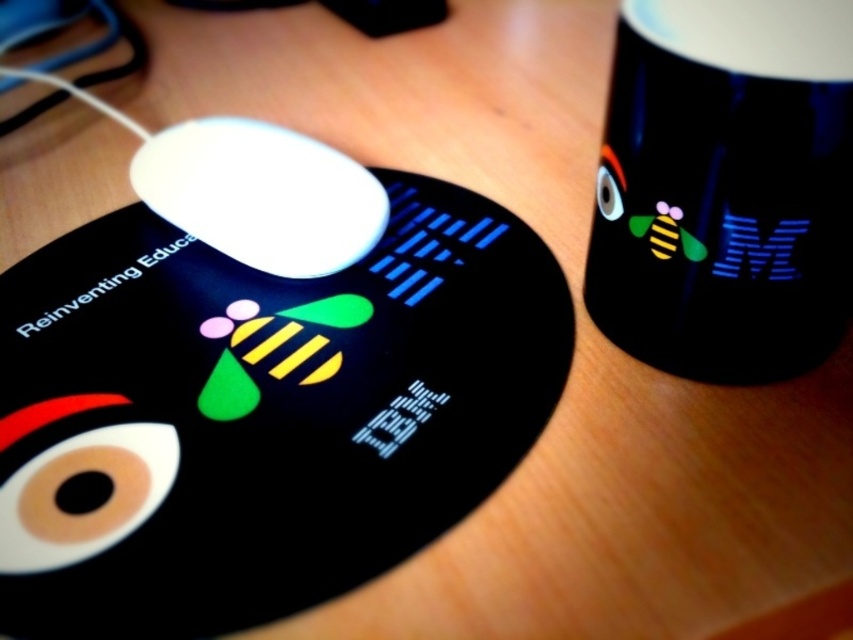
Between point (728, 12) and point (366, 193), which one is positioned in front?

Point (728, 12) is in front.

Which is in front, point (712, 160) or point (283, 163)?

Point (712, 160) is more forward.

Locate an element on the screen. black matte mug at upper right is located at coordinates (726, 188).